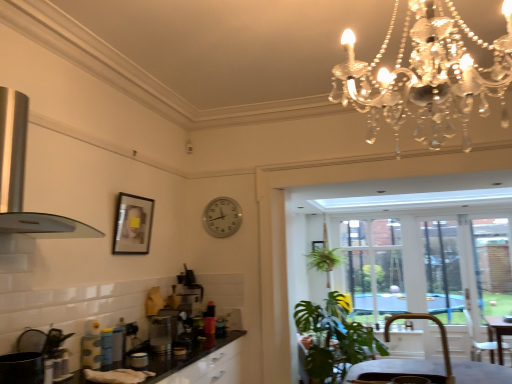
The height and width of the screenshot is (384, 512). Identify the location of transparent glass door at right, marked as the 3th window screen in a left-to-right arrangement. (492, 265).

Describe the element at coordinates (23, 179) in the screenshot. I see `silver metallic exhaust hood at left` at that location.

Describe the element at coordinates (334, 339) in the screenshot. I see `green leafy plant at center` at that location.

This screenshot has width=512, height=384. What are the coordinates of `transparent glass door at right, which is the 1th window screen in right-to-left order` in the screenshot? It's located at (492, 265).

Considering the positions of objects brown leather armchair at lower right and matte black picture frame at upper left, the second picture frame from the back, in the image provided, who is more to the left, brown leather armchair at lower right or matte black picture frame at upper left, the second picture frame from the back,?

Positioned to the left is matte black picture frame at upper left, the second picture frame from the back.

Is brown leather armchair at lower right located outside matte black picture frame at upper left, the first picture frame when ordered from left to right?

Yes, brown leather armchair at lower right is outside of matte black picture frame at upper left, the first picture frame when ordered from left to right.

Considering the sizes of objects brown leather armchair at lower right and matte black picture frame at upper left, arranged as the 2th picture frame when viewed from the right, in the image provided, who is shorter, brown leather armchair at lower right or matte black picture frame at upper left, arranged as the 2th picture frame when viewed from the right,?

brown leather armchair at lower right.

Is brown leather armchair at lower right oriented towards matte black picture frame at upper left, the first picture frame from the top?

No, brown leather armchair at lower right is not turned towards matte black picture frame at upper left, the first picture frame from the top.

Does point (349, 221) come closer to viewer compared to point (386, 330)?

No, (349, 221) is further to viewer.

Find the location of a particular element. armchair directly beneath the clear glass door at center, which is the 1th window screen in left-to-right order (from a real-world perspective) is located at coordinates (409, 367).

Looking at the image, does clear glass door at center, the 3th window screen viewed from the right, seem bigger or smaller compared to brown leather armchair at lower right?

Clearly, clear glass door at center, the 3th window screen viewed from the right, is larger in size than brown leather armchair at lower right.

Consider the image. Is silver metallic clock at center shorter than clear glass door at center, the 3th window screen viewed from the right?

Indeed, silver metallic clock at center has a lesser height compared to clear glass door at center, the 3th window screen viewed from the right.

From the image's perspective, is silver metallic clock at center under clear glass door at center, the 3th window screen viewed from the right?

Actually, silver metallic clock at center appears above clear glass door at center, the 3th window screen viewed from the right, in the image.

From a real-world perspective, does silver metallic clock at center stand above clear glass door at center, which is the 1th window screen in left-to-right order?

Indeed, from a real-world perspective, silver metallic clock at center stands above clear glass door at center, which is the 1th window screen in left-to-right order.

Is transparent glass window at center, the 2th window screen in the left-to-right sequence, inside or outside of matte black picture frame at upper left, the first picture frame when ordered from left to right?

transparent glass window at center, the 2th window screen in the left-to-right sequence, is not enclosed by matte black picture frame at upper left, the first picture frame when ordered from left to right.

From the picture: Which object is positioned more to the right, transparent glass window at center, the 2th window screen in the left-to-right sequence, or matte black picture frame at upper left, acting as the second picture frame starting from the bottom?

From the viewer's perspective, transparent glass window at center, the 2th window screen in the left-to-right sequence, appears more on the right side.

Considering the relative sizes of transparent glass window at center, placed as the 2th window screen when sorted from right to left, and matte black picture frame at upper left, placed as the first picture frame when sorted from front to back, in the image provided, is transparent glass window at center, placed as the 2th window screen when sorted from right to left, taller than matte black picture frame at upper left, placed as the first picture frame when sorted from front to back,?

Correct, transparent glass window at center, placed as the 2th window screen when sorted from right to left, is much taller as matte black picture frame at upper left, placed as the first picture frame when sorted from front to back.

Does transparent glass window at center, placed as the 2th window screen when sorted from right to left, touch matte black picture frame at upper left, placed as the first picture frame when sorted from front to back?

No, transparent glass window at center, placed as the 2th window screen when sorted from right to left, is not next to matte black picture frame at upper left, placed as the first picture frame when sorted from front to back.

From a real-world perspective, between silver metallic clock at center and transparent glass door at right, marked as the 3th window screen in a left-to-right arrangement, who is vertically lower?

From a 3D spatial view, transparent glass door at right, marked as the 3th window screen in a left-to-right arrangement, is below.

Which is nearer, (233, 215) or (487, 294)?

The point (233, 215) is closer to the camera.

From a real-world perspective, which is physically below, green leafy plant at center or matte black picture frame at upper left, the second picture frame from the back?

green leafy plant at center.

Is green leafy plant at center not within matte black picture frame at upper left, placed as the first picture frame when sorted from front to back?

That's correct, green leafy plant at center is outside of matte black picture frame at upper left, placed as the first picture frame when sorted from front to back.

Is point (308, 362) closer or farther from the camera than point (129, 232)?

Point (308, 362) is positioned farther from the camera compared to point (129, 232).

This screenshot has height=384, width=512. What are the coordinates of `appliance that is under the transparent glass window at center, the 2th window screen in the left-to-right sequence (from a real-world perspective)` in the screenshot? It's located at (162, 333).

Is transparent glass window at center, placed as the 2th window screen when sorted from right to left, with satin silver toaster at center?

No, transparent glass window at center, placed as the 2th window screen when sorted from right to left, is not beside satin silver toaster at center.

Which object is positioned more to the right, transparent glass window at center, placed as the 2th window screen when sorted from right to left, or satin silver toaster at center?

Positioned to the right is transparent glass window at center, placed as the 2th window screen when sorted from right to left.

Considering the sizes of objects transparent glass window at center, placed as the 2th window screen when sorted from right to left, and satin silver toaster at center in the image provided, who is smaller, transparent glass window at center, placed as the 2th window screen when sorted from right to left, or satin silver toaster at center?

Smaller between the two is satin silver toaster at center.

Find the location of a particular element. This screenshot has width=512, height=384. armchair on the right of matte black picture frame at upper left, the first picture frame when ordered from left to right is located at coordinates (409, 367).

Identify the location of armchair above the clear glass door at center, the 3th window screen viewed from the right (from the image's perspective). The height and width of the screenshot is (384, 512). tap(409, 367).

Which object lies further to the anchor point clear glass door at center, which is the 1th window screen in left-to-right order, matte black picture frame at upper left, acting as the second picture frame starting from the bottom, or silver metallic clock at center?

matte black picture frame at upper left, acting as the second picture frame starting from the bottom, is further to clear glass door at center, which is the 1th window screen in left-to-right order.

Which object lies further to the anchor point clear glass door at center, the 3th window screen viewed from the right, silver metallic exhaust hood at left or matte black picture frame at upper left, the first picture frame when ordered from left to right?

Among the two, silver metallic exhaust hood at left is located further to clear glass door at center, the 3th window screen viewed from the right.

From the image, which object appears to be farther from brown leather armchair at lower right, satin silver toaster at center or matte black picture frame at center, the second picture frame when ordered from left to right?

The object further to brown leather armchair at lower right is matte black picture frame at center, the second picture frame when ordered from left to right.

When comparing their distances from satin silver toaster at center, does green leafy plant at center or silver metallic exhaust hood at left seem closer?

The object closer to satin silver toaster at center is silver metallic exhaust hood at left.

Which object lies further to the anchor point satin silver toaster at center, silver metallic clock at center or clear glass door at center, the 3th window screen viewed from the right?

clear glass door at center, the 3th window screen viewed from the right, is further to satin silver toaster at center.

Estimate the real-world distances between objects in this image. Which object is further from silver metallic exhaust hood at left, matte black picture frame at upper left, the first picture frame from the top, or transparent glass window at center, placed as the 2th window screen when sorted from right to left?

transparent glass window at center, placed as the 2th window screen when sorted from right to left.

Considering their positions, is transparent glass door at right, which is the 1th window screen in right-to-left order, positioned closer to matte black picture frame at center, arranged as the 1th picture frame when viewed from the back, than silver metallic exhaust hood at left?

transparent glass door at right, which is the 1th window screen in right-to-left order, lies closer to matte black picture frame at center, arranged as the 1th picture frame when viewed from the back, than the other object.

Estimate the real-world distances between objects in this image. Which object is closer to green leafy plant at center, silver metallic clock at center or matte black picture frame at upper left, the second picture frame from the back?

A: silver metallic clock at center lies closer to green leafy plant at center than the other object.

This screenshot has height=384, width=512. Identify the location of armchair between satin silver toaster at center and green leafy plant at center. (409, 367).

You are a GUI agent. You are given a task and a screenshot of the screen. Output one action in this format:
    pyautogui.click(x=<x>, y=<y>)
    Task: Click on the clock between satin silver toaster at center and green leafy plant at center in the horizontal direction
    
    Given the screenshot: What is the action you would take?
    pyautogui.click(x=222, y=217)

Where is `appliance between matte black picture frame at upper left, arranged as the 2th picture frame when viewed from the right, and matte black picture frame at center, marked as the second picture frame in a front-to-back arrangement, in the front-back direction`? This screenshot has height=384, width=512. appliance between matte black picture frame at upper left, arranged as the 2th picture frame when viewed from the right, and matte black picture frame at center, marked as the second picture frame in a front-to-back arrangement, in the front-back direction is located at coordinates click(x=162, y=333).

Find the location of a particular element. houseplant located between silver metallic exhaust hood at left and transparent glass window at center, placed as the 2th window screen when sorted from right to left, in the depth direction is located at coordinates (334, 339).